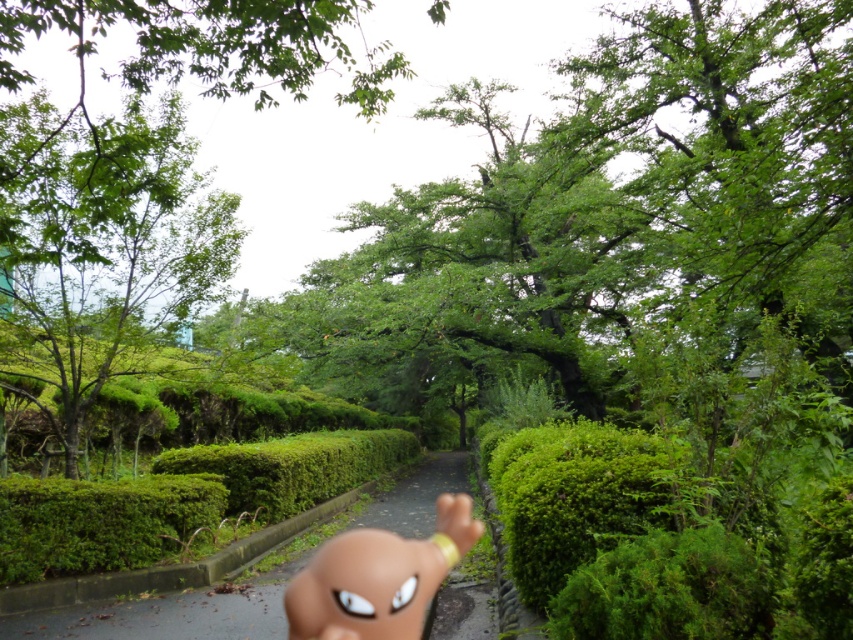
Question: Based on their relative distances, which object is nearer to the green hedge at center?

Choices:
 (A) brown matte doll at center
 (B) green leafy bush at center

Answer: (A)

Question: Among these points, which one is farthest from the camera?

Choices:
 (A) (91, 602)
 (B) (659, 515)
 (C) (196, 246)
 (D) (421, 602)

Answer: (C)

Question: Considering the relative positions of green hedge at center and brown matte doll at center in the image provided, where is green hedge at center located with respect to brown matte doll at center?

Choices:
 (A) above
 (B) below

Answer: (B)

Question: Observing the image, what is the correct spatial positioning of green hedge at center in reference to brown matte doll at center?

Choices:
 (A) below
 (B) above

Answer: (A)

Question: Among these objects, which one is farthest from the camera?

Choices:
 (A) green hedge at center
 (B) green leafy bush at center
 (C) brown matte doll at center

Answer: (A)

Question: Does green leafy tree at upper left come behind green hedge at center?

Choices:
 (A) no
 (B) yes

Answer: (B)